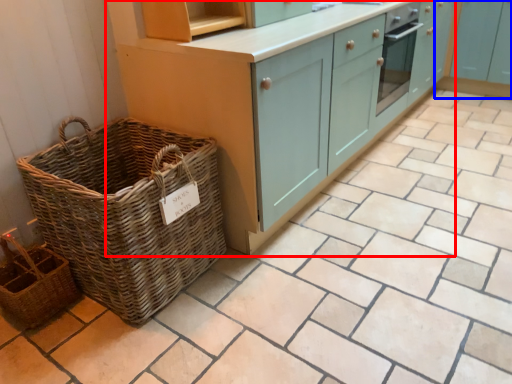
Question: Among these objects, which one is nearest to the camera, cabinetry (highlighted by a red box) or cabinetry (highlighted by a blue box)?

Choices:
 (A) cabinetry
 (B) cabinetry

Answer: (A)